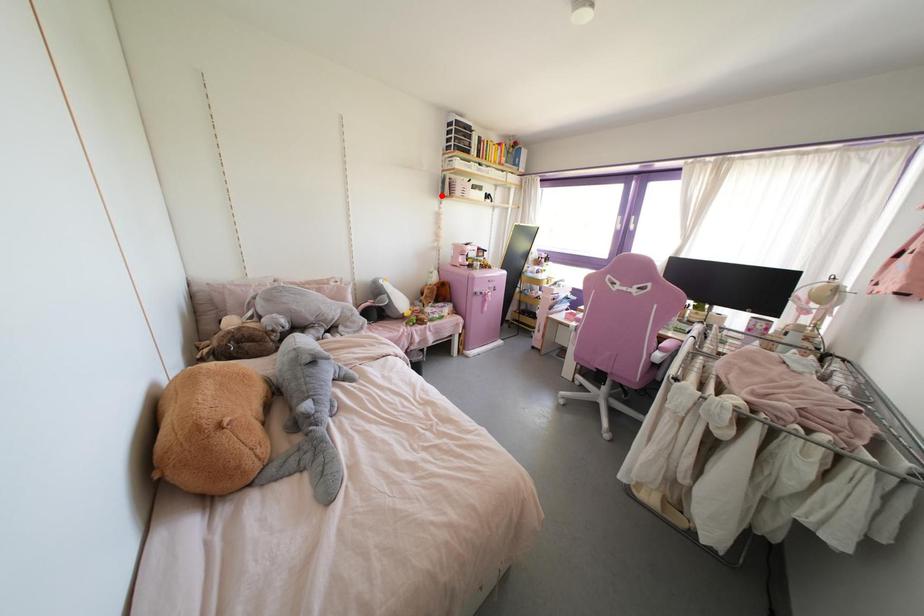
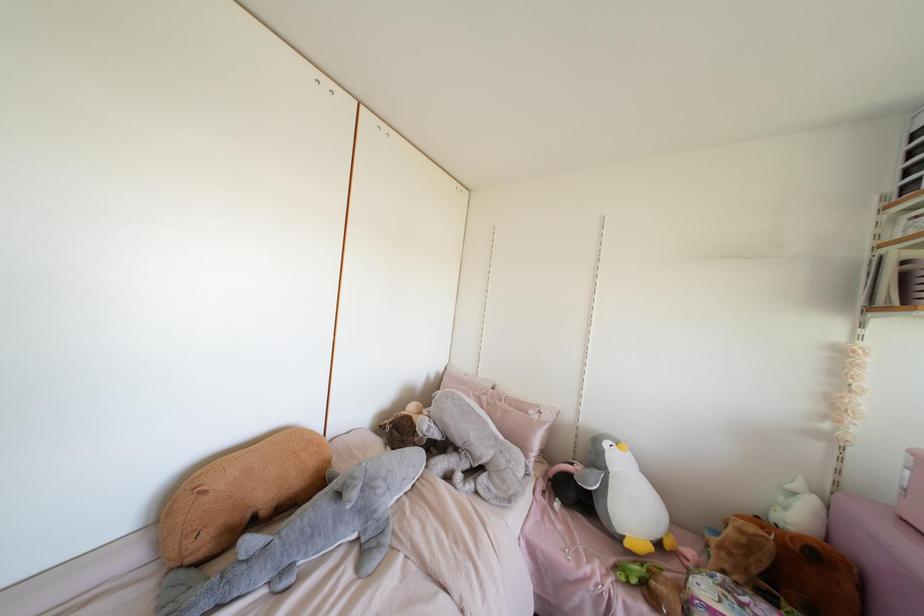
Find the pixel in the second image that matches the highlighted location in the first image.

(870, 307)